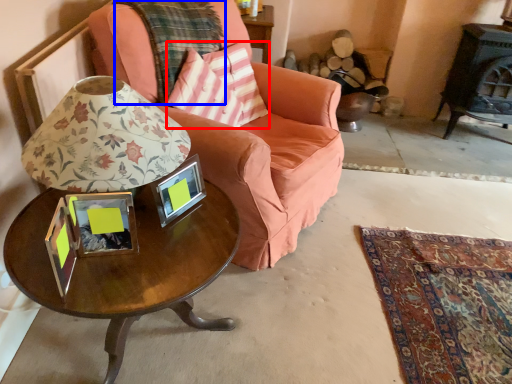
Question: Which object is closer to the camera taking this photo, throw pillow (highlighted by a red box) or plaid (highlighted by a blue box)?

Choices:
 (A) throw pillow
 (B) plaid

Answer: (B)